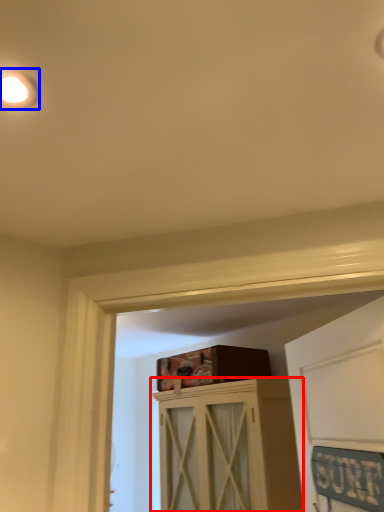
Question: Which object appears farthest to the camera in this image, cabinetry (highlighted by a red box) or droplight (highlighted by a blue box)?

Choices:
 (A) cabinetry
 (B) droplight

Answer: (A)